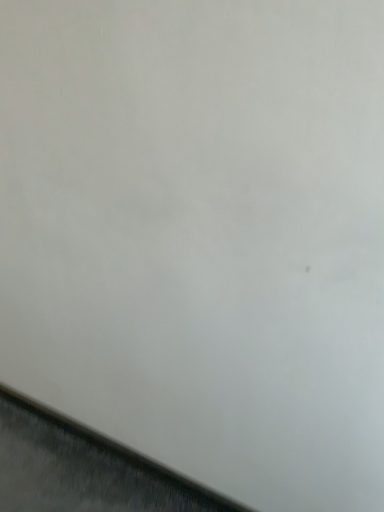
The image size is (384, 512). In order to click on dark gray carpet at lower left in this screenshot , I will do `click(83, 469)`.

What is the approximate width of dark gray carpet at lower left?

The width of dark gray carpet at lower left is 1.42 inches.

What do you see at coordinates (83, 469) in the screenshot? I see `dark gray carpet at lower left` at bounding box center [83, 469].

What is the approximate height of dark gray carpet at lower left?

The height of dark gray carpet at lower left is 12.33 centimeters.

Find the location of a particular element. dark gray carpet at lower left is located at coordinates (83, 469).